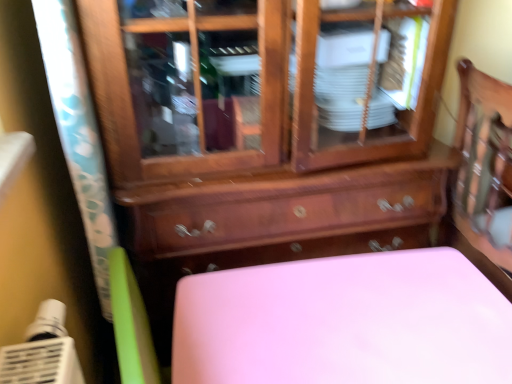
Question: Does wooden cabinet at center have a smaller size compared to pink matte table at lower center?

Choices:
 (A) no
 (B) yes

Answer: (A)

Question: Considering the relative sizes of wooden cabinet at center and pink matte table at lower center in the image provided, is wooden cabinet at center wider than pink matte table at lower center?

Choices:
 (A) no
 (B) yes

Answer: (B)

Question: From a real-world perspective, is wooden cabinet at center beneath pink matte table at lower center?

Choices:
 (A) yes
 (B) no

Answer: (B)

Question: Is wooden cabinet at center oriented away from pink matte table at lower center?

Choices:
 (A) yes
 (B) no

Answer: (B)

Question: Is wooden cabinet at center taller than pink matte table at lower center?

Choices:
 (A) no
 (B) yes

Answer: (B)

Question: From the image's perspective, is wooden cabinet at center beneath pink matte table at lower center?

Choices:
 (A) yes
 (B) no

Answer: (B)

Question: Is pink matte table at lower center touching wooden cabinet at center?

Choices:
 (A) no
 (B) yes

Answer: (A)

Question: Would you say pink matte table at lower center is outside wooden cabinet at center?

Choices:
 (A) no
 (B) yes

Answer: (B)

Question: Is pink matte table at lower center to the left of wooden cabinet at center from the viewer's perspective?

Choices:
 (A) yes
 (B) no

Answer: (B)

Question: Does pink matte table at lower center come behind wooden cabinet at center?

Choices:
 (A) no
 (B) yes

Answer: (B)

Question: Is pink matte table at lower center bigger than wooden cabinet at center?

Choices:
 (A) yes
 (B) no

Answer: (B)

Question: From a real-world perspective, is pink matte table at lower center physically below wooden cabinet at center?

Choices:
 (A) yes
 (B) no

Answer: (A)

Question: In terms of width, does wooden cabinet at center look wider or thinner when compared to pink matte table at lower center?

Choices:
 (A) thin
 (B) wide

Answer: (B)